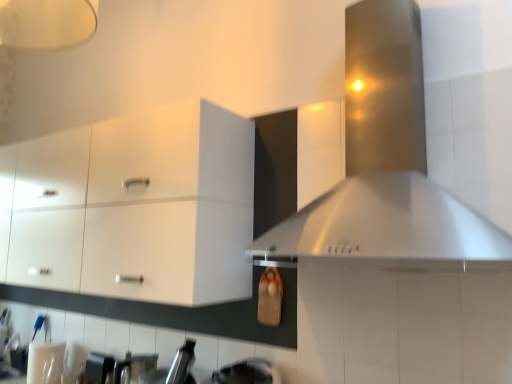
Question: From the image's perspective, is white glossy cabinet at upper left above metallic silver toaster at lower left?

Choices:
 (A) no
 (B) yes

Answer: (B)

Question: From a real-world perspective, is white glossy cabinet at upper left positioned under metallic silver toaster at lower left based on gravity?

Choices:
 (A) yes
 (B) no

Answer: (B)

Question: From a real-world perspective, is white glossy cabinet at upper left located higher than metallic silver toaster at lower left?

Choices:
 (A) no
 (B) yes

Answer: (B)

Question: Is white glossy cabinet at upper left located outside metallic silver toaster at lower left?

Choices:
 (A) no
 (B) yes

Answer: (B)

Question: Is white glossy cabinet at upper left in contact with metallic silver toaster at lower left?

Choices:
 (A) yes
 (B) no

Answer: (B)

Question: Does white glossy cabinet at upper left have a lesser width compared to metallic silver toaster at lower left?

Choices:
 (A) yes
 (B) no

Answer: (B)

Question: Does stainless steel vent at upper right come behind metallic silver toaster at lower left?

Choices:
 (A) yes
 (B) no

Answer: (B)

Question: Does stainless steel vent at upper right lie in front of metallic silver toaster at lower left?

Choices:
 (A) no
 (B) yes

Answer: (B)

Question: Is stainless steel vent at upper right facing away from metallic silver toaster at lower left?

Choices:
 (A) yes
 (B) no

Answer: (B)

Question: Does stainless steel vent at upper right have a larger size compared to metallic silver toaster at lower left?

Choices:
 (A) yes
 (B) no

Answer: (A)

Question: Could metallic silver toaster at lower left be considered to be inside stainless steel vent at upper right?

Choices:
 (A) yes
 (B) no

Answer: (B)

Question: Is stainless steel vent at upper right aimed at metallic silver toaster at lower left?

Choices:
 (A) yes
 (B) no

Answer: (B)

Question: Is metallic silver toaster at lower left taller than stainless steel vent at upper right?

Choices:
 (A) no
 (B) yes

Answer: (A)